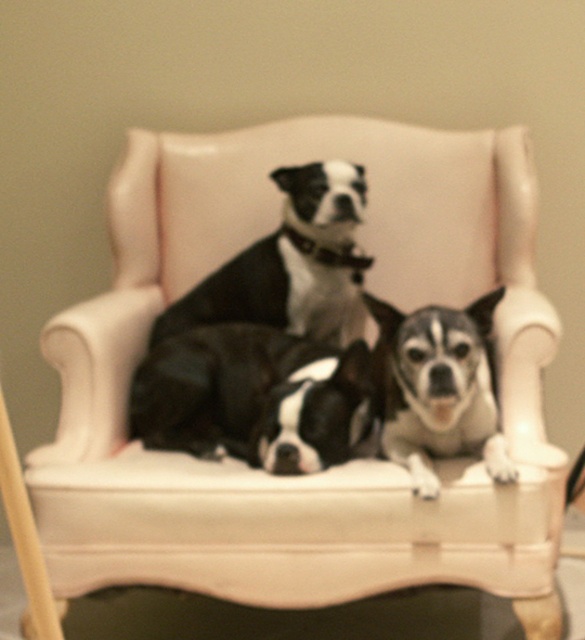
Is black matte dog at center wider than speckled fur dog at center?

Yes, black matte dog at center is wider than speckled fur dog at center.

Where is `black matte dog at center`? This screenshot has width=585, height=640. black matte dog at center is located at coordinates (291, 264).

Between black and white fur at center and speckled fur dog at center, which one appears on the left side from the viewer's perspective?

black and white fur at center

Which is behind, point (263, 412) or point (445, 397)?

Point (263, 412)

The height and width of the screenshot is (640, 585). What do you see at coordinates (256, 397) in the screenshot?
I see `black and white fur at center` at bounding box center [256, 397].

Find the location of a particular element. The height and width of the screenshot is (640, 585). black and white fur at center is located at coordinates (256, 397).

Who is taller, black and white fur at center or black matte dog at center?

Standing taller between the two is black matte dog at center.

Is point (180, 356) behind point (304, 332)?

No.

Consider the image. Measure the distance between black and white fur at center and camera.

A distance of 5.61 feet exists between black and white fur at center and camera.

Find the location of a particular element. black and white fur at center is located at coordinates (256, 397).